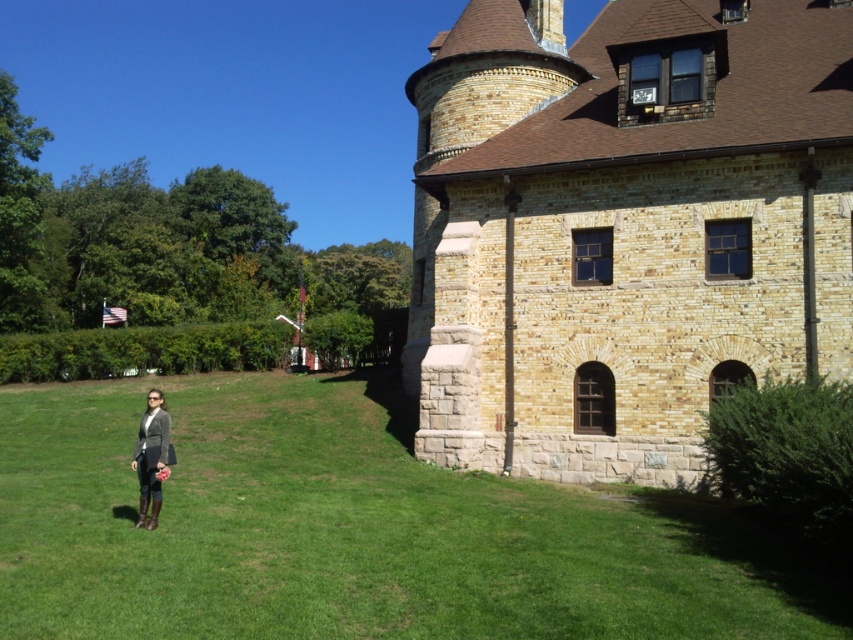
Is point (178, 605) positioned before point (148, 497)?

Yes, it is.

Who is shorter, green grass at lower left or matte gray blazer at lower left?

Standing shorter between the two is green grass at lower left.

Image resolution: width=853 pixels, height=640 pixels. Identify the location of green grass at lower left. (358, 529).

Between brown stone castle at center and matte gray blazer at lower left, which one has more height?

brown stone castle at center

Does brown stone castle at center have a smaller size compared to matte gray blazer at lower left?

Incorrect, brown stone castle at center is not smaller in size than matte gray blazer at lower left.

Between point (775, 180) and point (157, 429), which one is positioned in front?

Point (157, 429)

The height and width of the screenshot is (640, 853). Identify the location of brown stone castle at center. (624, 227).

Who is lower down, brown stone castle at center or green grass at lower left?

green grass at lower left

Between brown stone castle at center and green grass at lower left, which one is positioned higher?

brown stone castle at center

Which is behind, point (659, 64) or point (138, 538)?

Positioned behind is point (659, 64).

Locate an element on the screen. The height and width of the screenshot is (640, 853). brown stone castle at center is located at coordinates (624, 227).